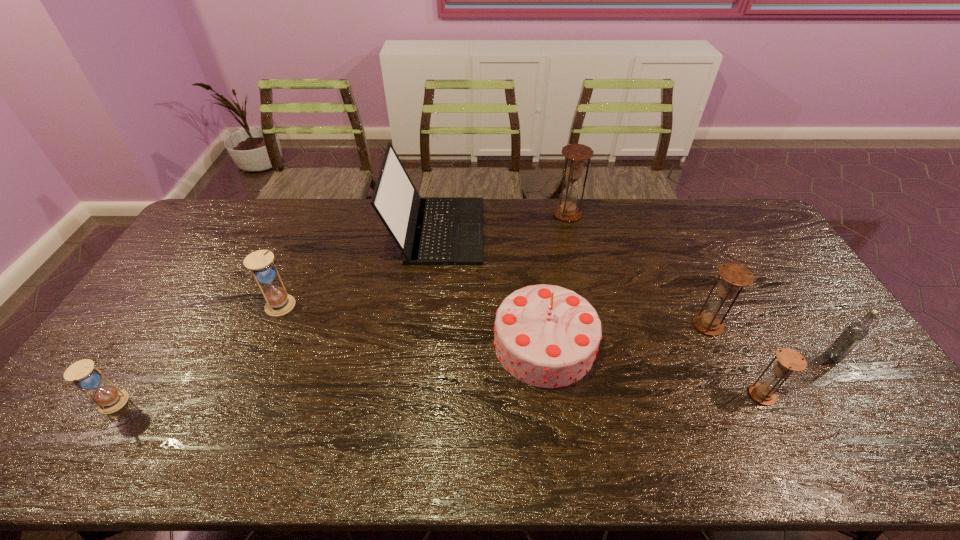
I want to click on the leftmost object, so coord(82,374).

Locate an element on the screen. The width and height of the screenshot is (960, 540). the nearer white hourglass is located at coordinates (82, 374).

Where is `free space located 0.150m on the right of the farthest brown hourglass`? This screenshot has width=960, height=540. free space located 0.150m on the right of the farthest brown hourglass is located at coordinates (621, 214).

At what (x,y) coordinates should I click in order to perform the action: click on blank area located on the surface of the laptop. Please return your answer as a coordinate pair (x, y). Looking at the image, I should click on (593, 231).

I want to click on vacant point located 0.360m on the front of the second nearest brown hourglass, so click(772, 464).

Find the location of a particular element. Image resolution: width=960 pixels, height=540 pixels. free location located 0.340m on the front of the right white hourglass is located at coordinates (232, 423).

Image resolution: width=960 pixels, height=540 pixels. I want to click on free spot located on the back of the birthday cake, so click(x=531, y=236).

Find the location of a particular element. free spot located 0.080m on the label of the rightmost object is located at coordinates click(x=854, y=390).

Where is `free space located 0.280m on the back of the nearest brown hourglass`? free space located 0.280m on the back of the nearest brown hourglass is located at coordinates (716, 303).

At what (x,y) coordinates should I click in order to perform the action: click on free space located 0.180m on the right of the left white hourglass. Please return your answer as a coordinate pair (x, y). Looking at the image, I should click on (197, 403).